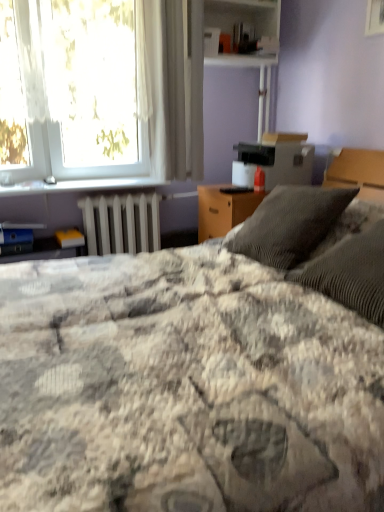
Question: From a real-world perspective, is white sheer curtain at upper center physically located above or below metallic silver window sill at upper left?

Choices:
 (A) above
 (B) below

Answer: (A)

Question: Based on their sizes in the image, would you say white sheer curtain at upper center is bigger or smaller than metallic silver window sill at upper left?

Choices:
 (A) big
 (B) small

Answer: (A)

Question: Based on their relative distances, which object is farther from the white plastic shelf at upper center?

Choices:
 (A) fluffy gray blanket at center
 (B) white sheer curtain at upper left
 (C) white metallic radiator at lower left
 (D) metallic silver window sill at upper left
 (E) white sheer curtain at upper center

Answer: (A)

Question: Estimate the real-world distances between objects in this image. Which object is closer to the white metallic radiator at lower left?

Choices:
 (A) white sheer curtain at upper center
 (B) metallic silver window sill at upper left
 (C) fluffy gray blanket at center
 (D) white sheer curtain at upper left
 (E) white plastic shelf at upper center

Answer: (B)